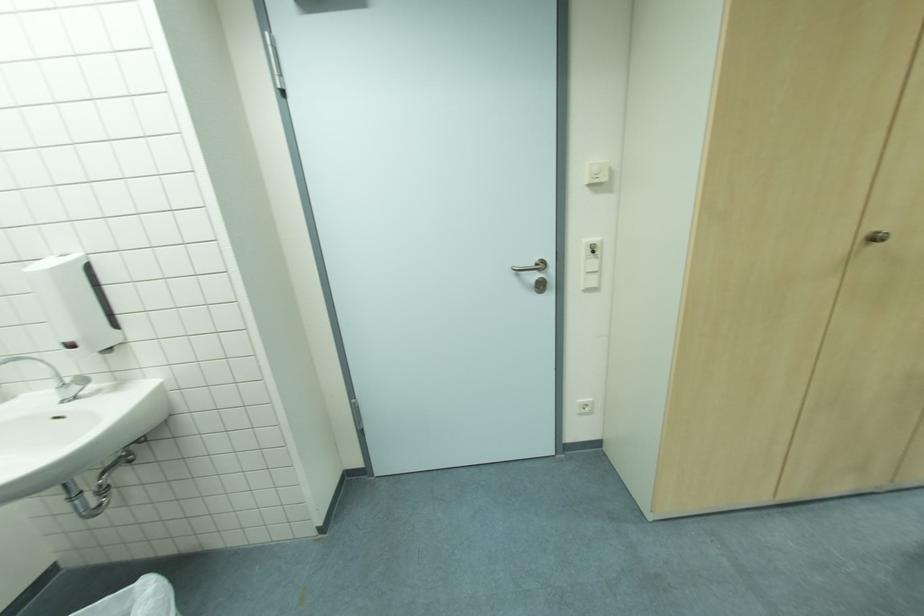
Identify the location of white light switch. (590, 281).